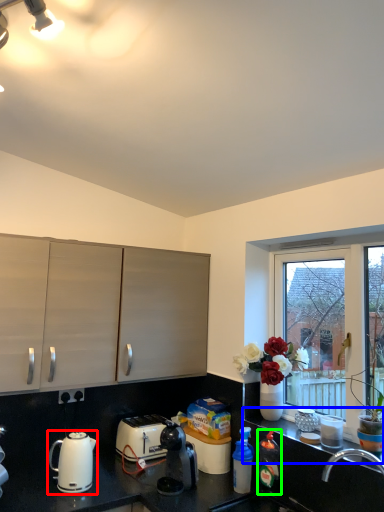
Question: Which is nearer to the kettle (highlighted by a red box)? window sill (highlighted by a blue box) or bottle (highlighted by a green box).

Choices:
 (A) window sill
 (B) bottle

Answer: (B)